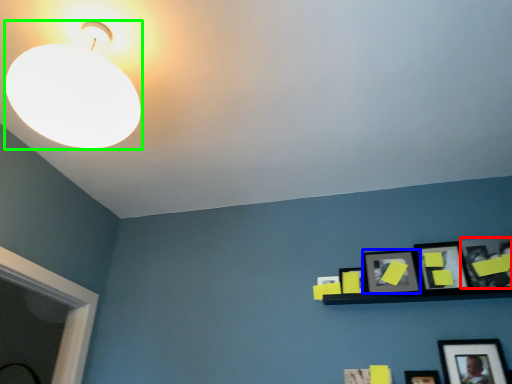
Question: Which object is positioned farthest from picture frame (highlighted by a red box)? Select from picture frame (highlighted by a blue box) and lamp (highlighted by a green box).

Choices:
 (A) picture frame
 (B) lamp

Answer: (B)